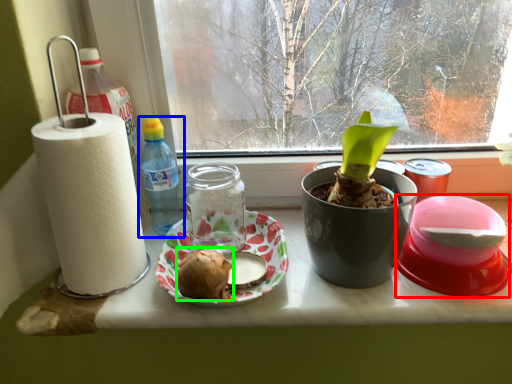
Question: Estimate the real-world distances between objects in this image. Which object is farther from appliance (highlighted by a red box), bottle (highlighted by a blue box) or food (highlighted by a green box)?

Choices:
 (A) bottle
 (B) food

Answer: (A)